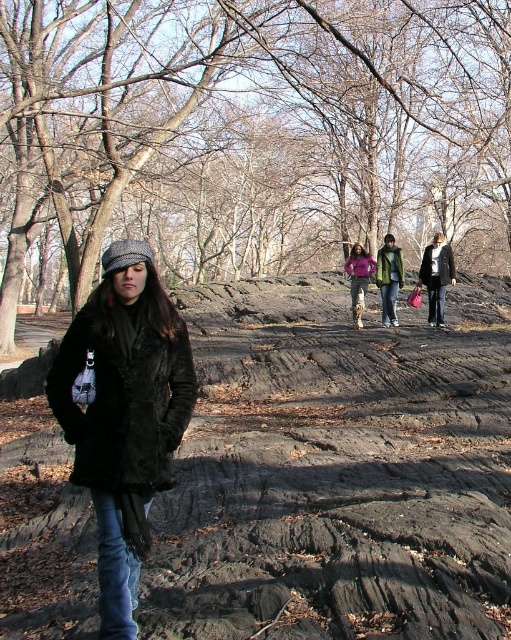
Question: Does dark brown fur coat at center appear on the left side of dark gray woolen coat at center?

Choices:
 (A) no
 (B) yes

Answer: (B)

Question: Among these objects, which one is nearest to the camera?

Choices:
 (A) green matte jacket at center
 (B) brown bark tree at center

Answer: (B)

Question: In this image, where is dark brown fur coat at center located relative to dark gray woolen coat at center?

Choices:
 (A) right
 (B) left

Answer: (B)

Question: Which of the following is the closest to the observer?

Choices:
 (A) (115, 483)
 (B) (50, 33)
 (C) (330, 518)
 (D) (438, 269)

Answer: (A)

Question: Which object is positioned farthest from the dark brown fur coat at center?

Choices:
 (A) purple fuzzy sweater at center
 (B) dark brown textured dirt track at center
 (C) green matte jacket at center

Answer: (A)

Question: Observing the image, what is the correct spatial positioning of dark brown textured dirt track at center in reference to dark gray woolen coat at center?

Choices:
 (A) below
 (B) above

Answer: (A)